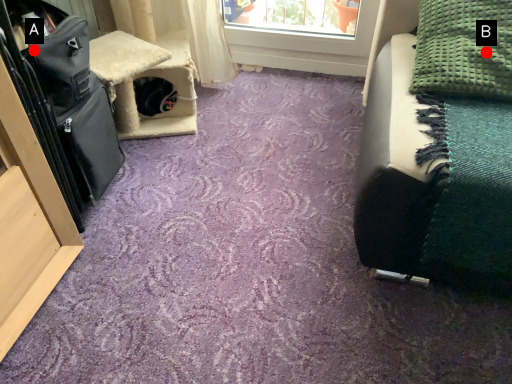
Question: Two points are circled on the image, labeled by A and B beside each circle. Which point is closer to the camera?

Choices:
 (A) A is closer
 (B) B is closer

Answer: (A)